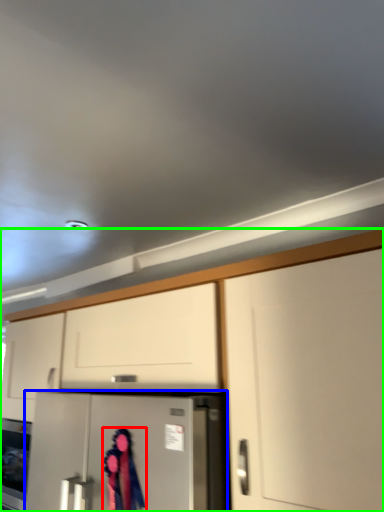
Question: Which is farther away from woman (highlighted by a red box)? refrigerator (highlighted by a blue box) or cabinetry (highlighted by a green box)?

Choices:
 (A) refrigerator
 (B) cabinetry

Answer: (B)